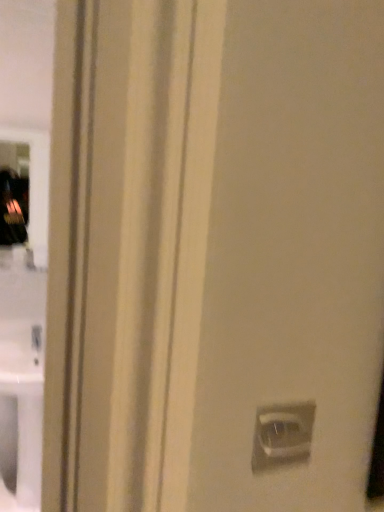
Describe the element at coordinates (282, 435) in the screenshot. I see `satin silver switch at lower right` at that location.

At what (x,y) coordinates should I click in order to perform the action: click on satin silver switch at lower right. Please return your answer as a coordinate pair (x, y). The height and width of the screenshot is (512, 384). Looking at the image, I should click on pyautogui.click(x=282, y=435).

The image size is (384, 512). I want to click on satin silver switch at lower right, so click(x=282, y=435).